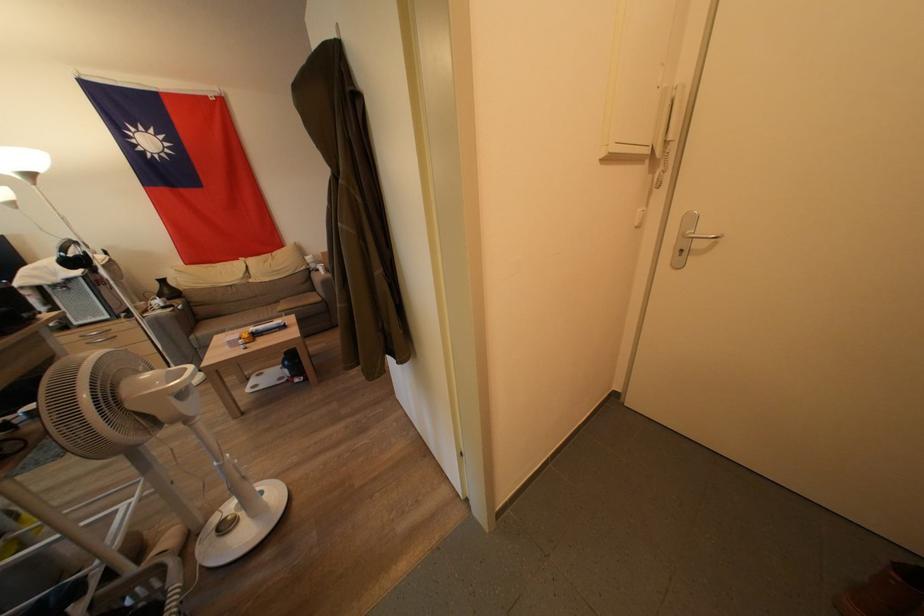
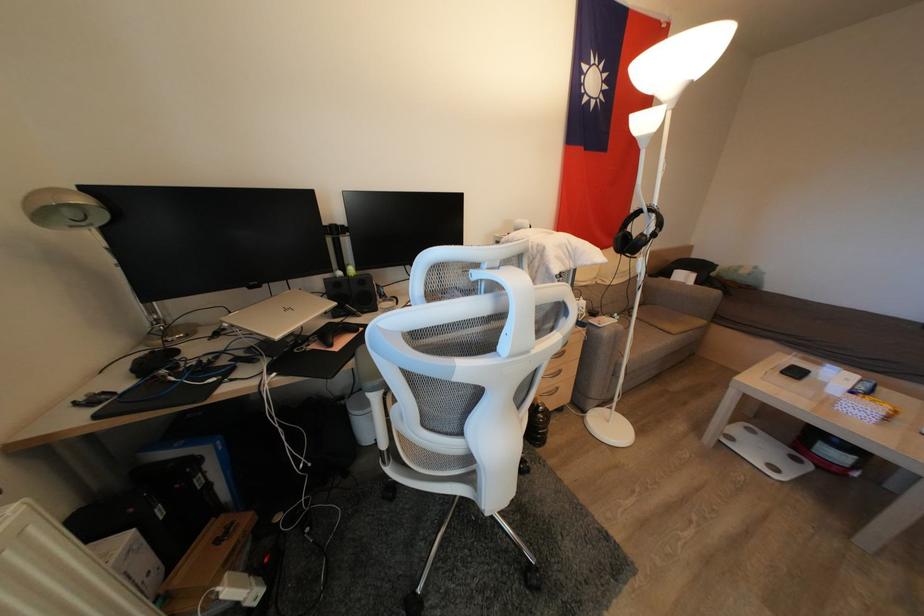
Question: What movement of the cameraman would produce the second image?

Choices:
 (A) Left
 (B) Right
 (C) Forward
 (D) Backward

Answer: (A)